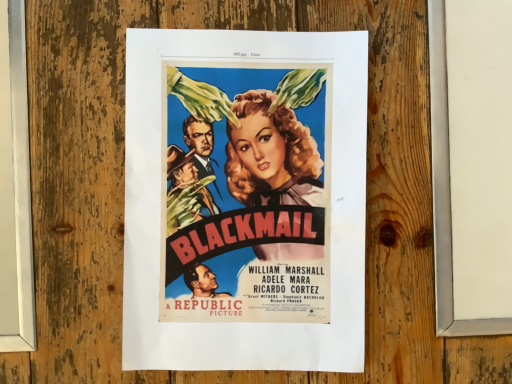
Find the location of a particular element. The height and width of the screenshot is (384, 512). free space above vivid paper poster at center (from a real-world perspective) is located at coordinates (248, 203).